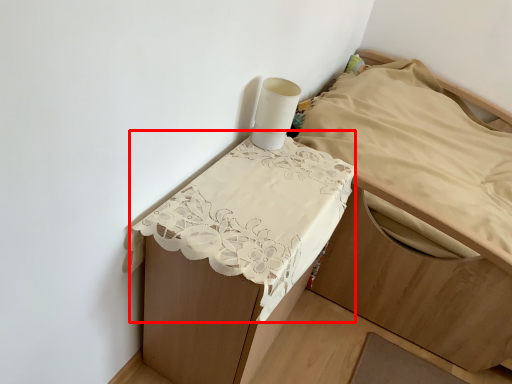
Question: In this image, where is sheet (annotated by the red box) located relative to furniture?

Choices:
 (A) right
 (B) left

Answer: (B)